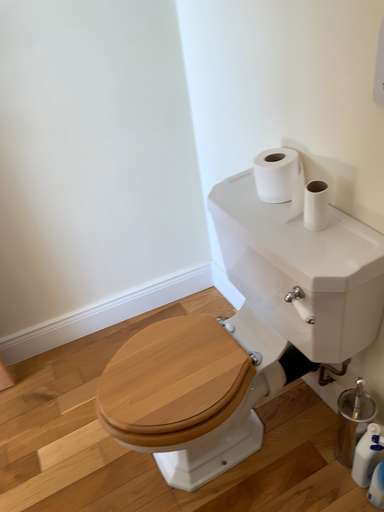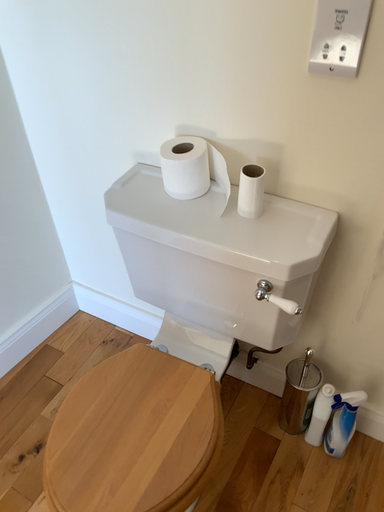
Question: Which way did the camera rotate in the video?

Choices:
 (A) rotated left
 (B) rotated right

Answer: (B)